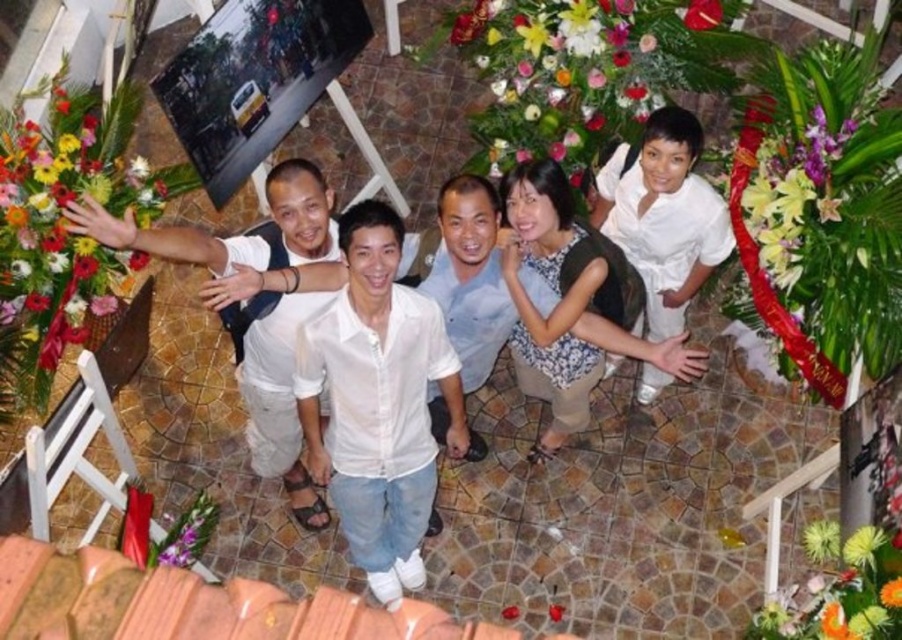
You are at a party and want to take a photo with the floral arrangement at upper center and the floral bouquet at left. Which one should you stand closer to if you want both to be in focus?

You should stand closer to the floral arrangement at upper center because it is closer to you than the floral bouquet at left, so focusing on it will also keep the bouquet in focus.

You are a photographer at the event and want to ensure that both the floral arrangement at upper center and the purple silk flower at upper right are visible in your wide shot. Which one should you focus on first to ensure both are in frame?

The floral arrangement at upper center is larger in size than the purple silk flower at upper right, so you should focus on the floral arrangement at upper center first to ensure both are in frame.

You are planning to take a photo of the floral arrangement at upper center and floral bouquet at left. Which one is located higher in the image?

The floral arrangement at upper center is located higher than the floral bouquet at left.